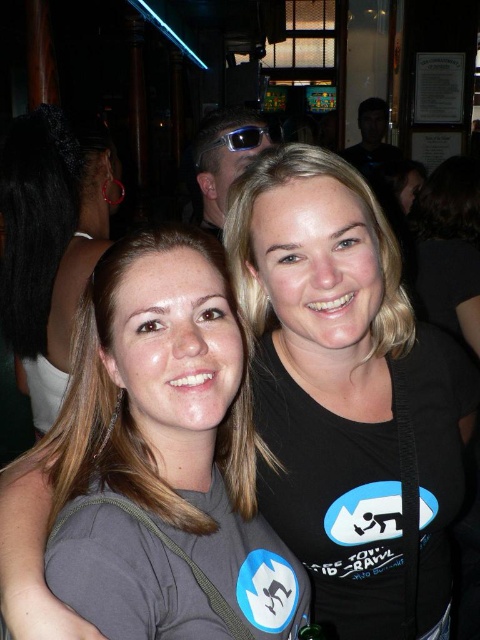
Looking at this image, is matte gray shirt at center smaller than matte black sunglasses at upper center?

No, matte gray shirt at center is not smaller than matte black sunglasses at upper center.

Is matte gray shirt at center below matte black sunglasses at upper center?

Yes.

Identify the location of matte gray shirt at center. The image size is (480, 640). (49, 243).

Which is more to the right, gray matte shirt at center or shiny blue plastic goggles at center?

shiny blue plastic goggles at center is more to the right.

Can you confirm if gray matte shirt at center is wider than shiny blue plastic goggles at center?

Indeed, gray matte shirt at center has a greater width compared to shiny blue plastic goggles at center.

At what (x,y) coordinates should I click in order to perform the action: click on gray matte shirt at center. Please return your answer as a coordinate pair (x, y). The image size is (480, 640). Looking at the image, I should click on (163, 458).

In order to click on gray matte shirt at center in this screenshot , I will do `click(163, 458)`.

Is gray matte shirt at center bigger than matte gray shirt at center?

No.

Who is taller, gray matte shirt at center or matte gray shirt at center?

matte gray shirt at center

Is point (230, 294) farther from camera compared to point (43, 317)?

No, it is not.

This screenshot has width=480, height=640. Find the location of `gray matte shirt at center`. gray matte shirt at center is located at coordinates (163, 458).